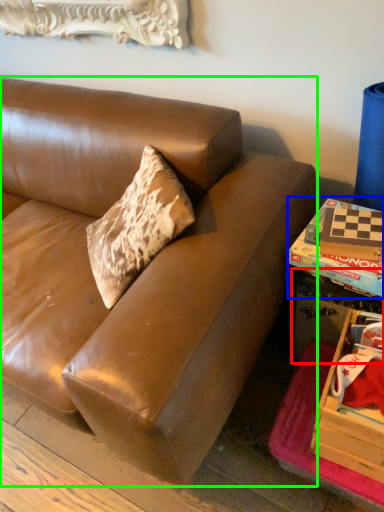
Question: Considering the real-world distances, which object is closest to table (highlighted by a red box)? book (highlighted by a blue box) or studio couch (highlighted by a green box).

Choices:
 (A) book
 (B) studio couch

Answer: (A)